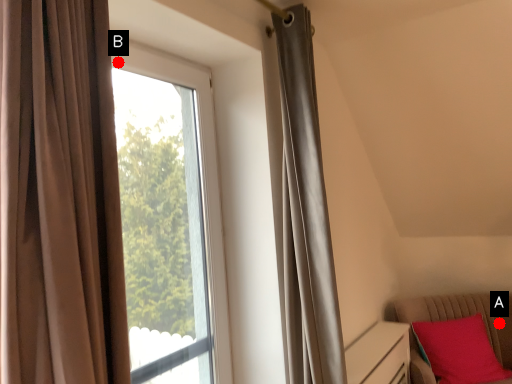
Question: Two points are circled on the image, labeled by A and B beside each circle. Which point is closer to the camera?

Choices:
 (A) A is closer
 (B) B is closer

Answer: (B)